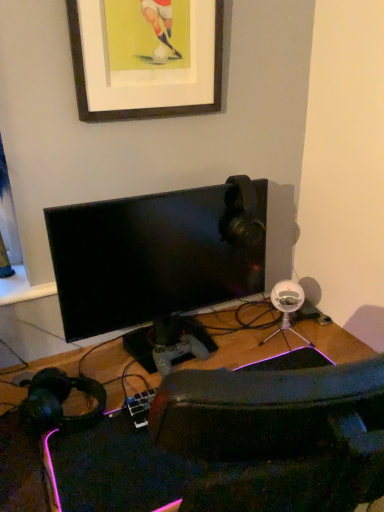
Image resolution: width=384 pixels, height=512 pixels. I want to click on free point below black glossy monitor at center (from a real-world perspective), so click(144, 358).